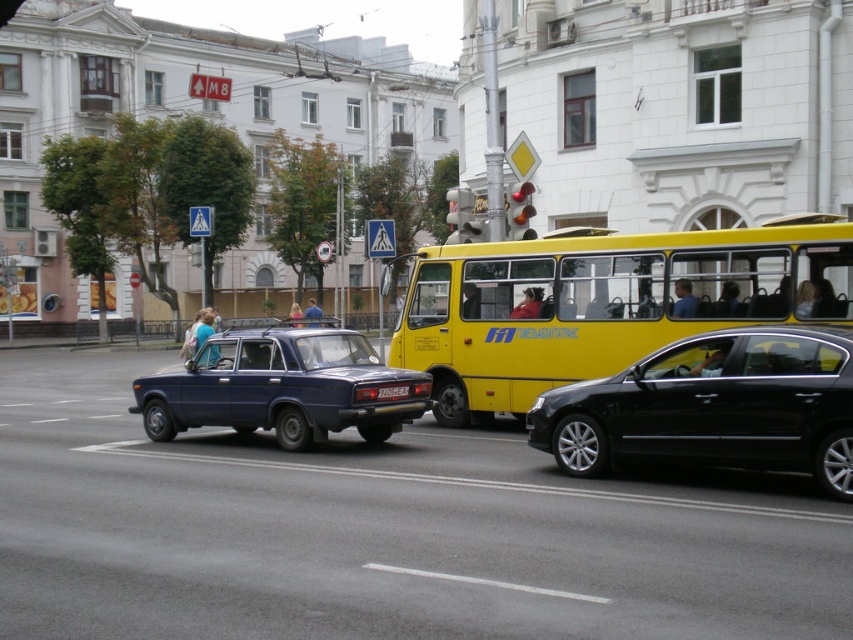
Find the location of a particular element. black metallic car at center is located at coordinates (714, 406).

Between black metallic car at center and matte blue sedan at center, which one appears on the left side from the viewer's perspective?

Positioned to the left is matte blue sedan at center.

The width and height of the screenshot is (853, 640). What do you see at coordinates (714, 406) in the screenshot?
I see `black metallic car at center` at bounding box center [714, 406].

The image size is (853, 640). Identify the location of black metallic car at center. (714, 406).

Does yellow matte bus at center come behind matte blue sedan at center?

Yes, yellow matte bus at center is further from the viewer.

How distant is yellow matte bus at center from matte blue sedan at center?

yellow matte bus at center is 9.63 feet away from matte blue sedan at center.

From the picture: Who is more distant from viewer, [395,346] or [334,340]?

The point [395,346] is behind.

This screenshot has height=640, width=853. Find the location of `yellow matte bus at center`. yellow matte bus at center is located at coordinates (601, 304).

Is yellow matte bus at center bigger than black metallic car at center?

No, yellow matte bus at center is not bigger than black metallic car at center.

Does point (585, 362) lie behind point (817, 448)?

Yes, it is behind point (817, 448).

Find the location of a particular element. The height and width of the screenshot is (640, 853). yellow matte bus at center is located at coordinates (601, 304).